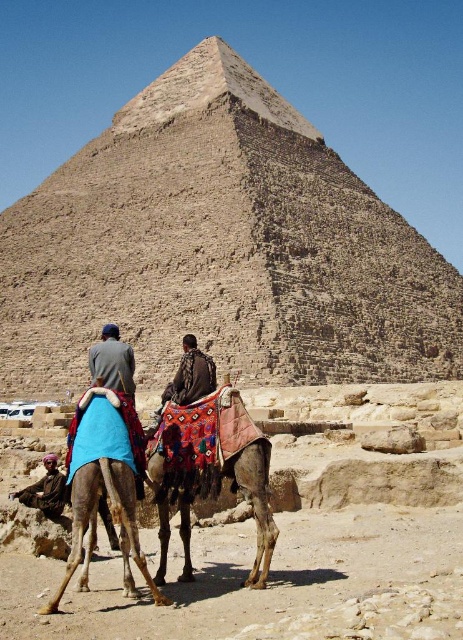
You are a photographer planning to take a photo of the Pyramid of Khafre. You want to ensure both the brown textured camel at lower left and the multicolored fabric camel at center are in the frame. Which camel should you position closer to the pyramid to maintain their relative sizes in the photo?

The brown textured camel at lower left is shorter than the multicolored fabric camel at center. To maintain their relative sizes, you should position the brown textured camel at lower left closer to the pyramid so it appears proportionally sized compared to the taller multicolored fabric camel at center.

You are a tourist standing in front of the Pyramid of Khafre and see the multicolored fabric camel at center and the blue fabric camel at lower left. Which camel is closer to the pyramid?

The blue fabric camel at lower left is closer to the Pyramid of Khafre because it is positioned to the left of the multicolored fabric camel at center, which is further away.

You are a tourist standing at the base of the brown stone pyramid at center and want to take a photo of the multicolored fabric camel at center. Considering their heights, which one will appear larger in the photo?

The brown stone pyramid at center is taller than the multicolored fabric camel at center, so the pyramid will appear larger in the photo.